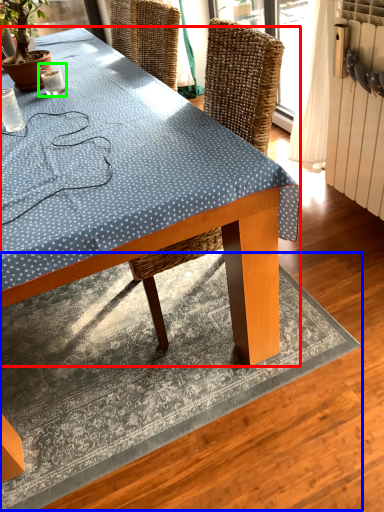
Question: Considering the real-world distances, which object is closest to desk (highlighted by a red box)? mat (highlighted by a blue box) or coffee cup (highlighted by a green box).

Choices:
 (A) mat
 (B) coffee cup

Answer: (A)